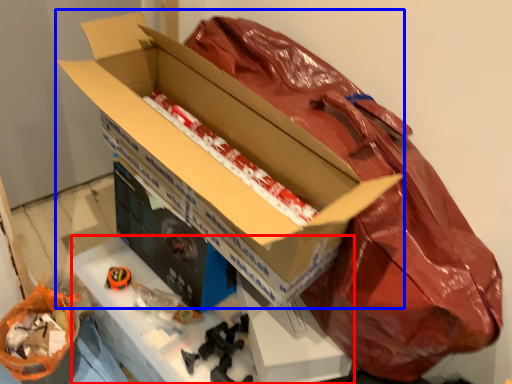
Question: Which point is closer to the camera, workbench (highlighted by a red box) or box (highlighted by a blue box)?

Choices:
 (A) workbench
 (B) box

Answer: (B)